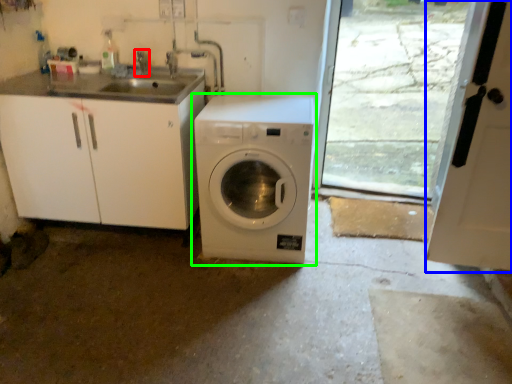
Question: Which is nearer to the faucet (highlighted by a red box)? screen door (highlighted by a blue box) or washing machine (highlighted by a green box).

Choices:
 (A) screen door
 (B) washing machine

Answer: (B)